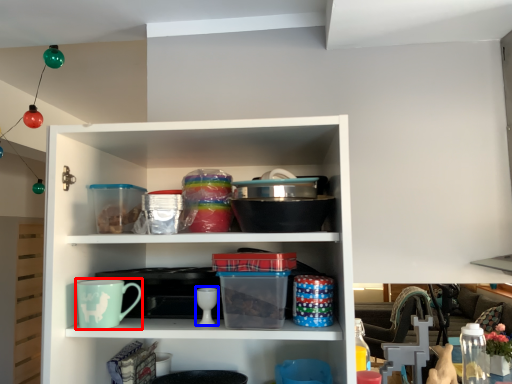
Question: Which object is closer to the camera taking this photo, mug (highlighted by a red box) or tableware (highlighted by a blue box)?

Choices:
 (A) mug
 (B) tableware

Answer: (A)